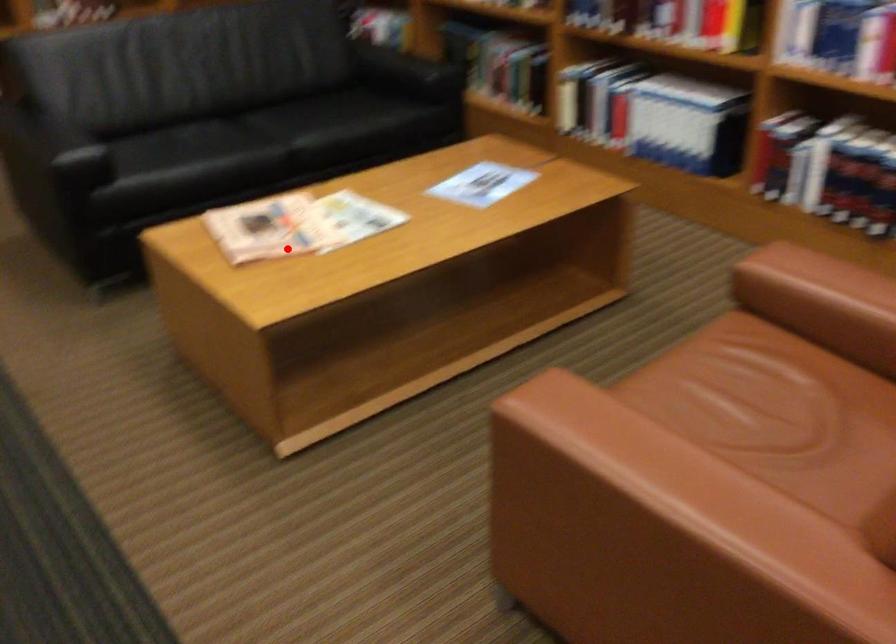
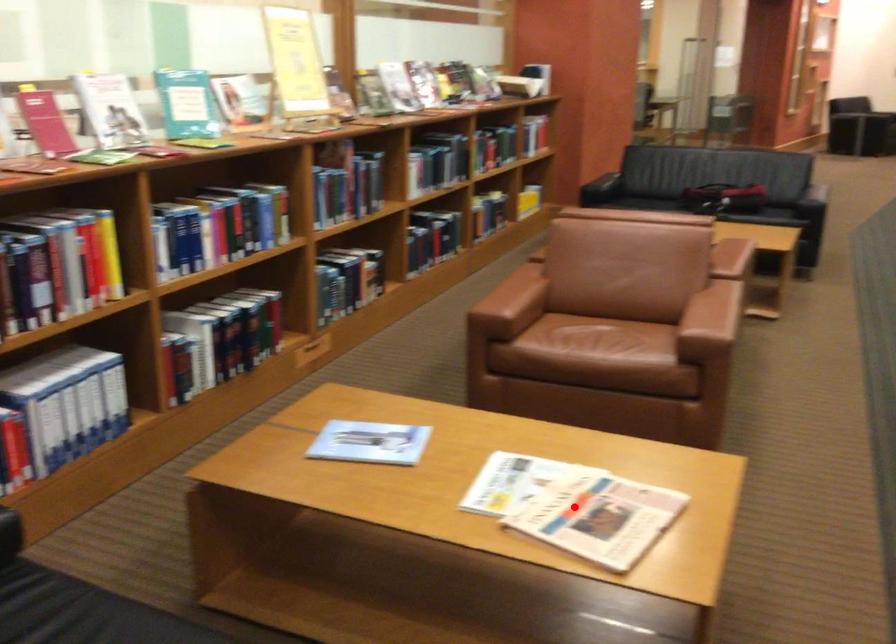
Looking at this image, I am providing you with two images of the same scene from different viewpoints. A red point is marked on the first image and another point is marked on the second image. Are the points marked in image1 and image2 representing the same 3D position?

Yes